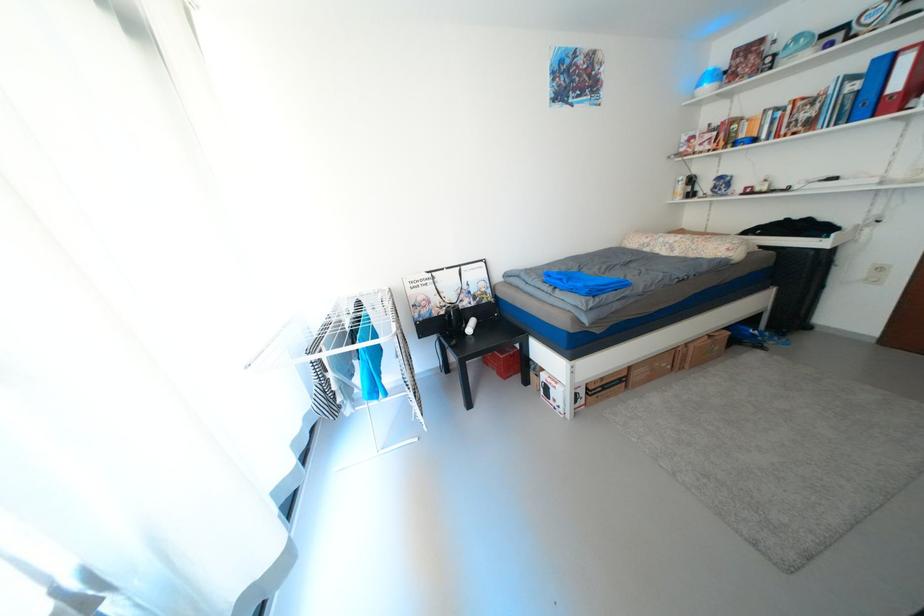
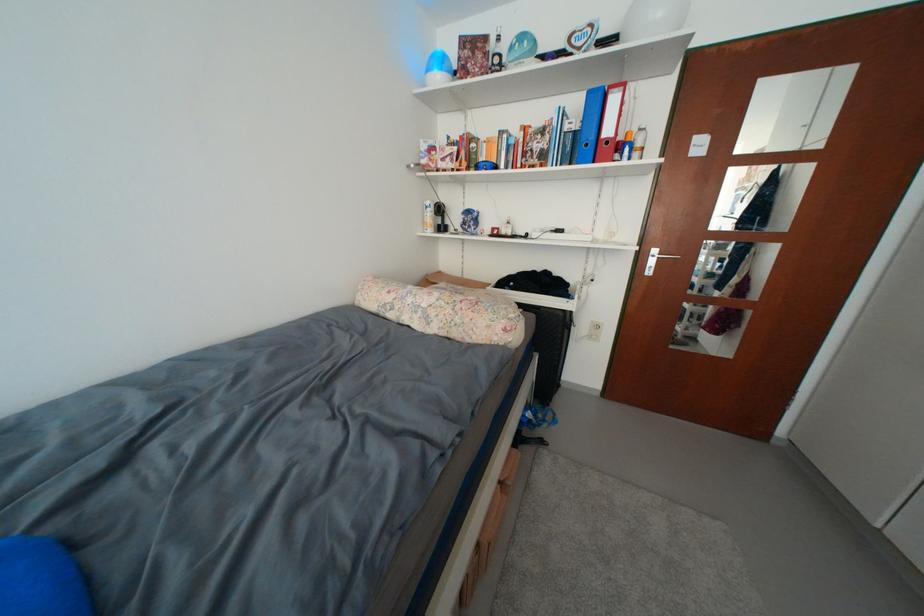
Find the pixel in the second image that matches (683,196) in the first image.

(432, 225)